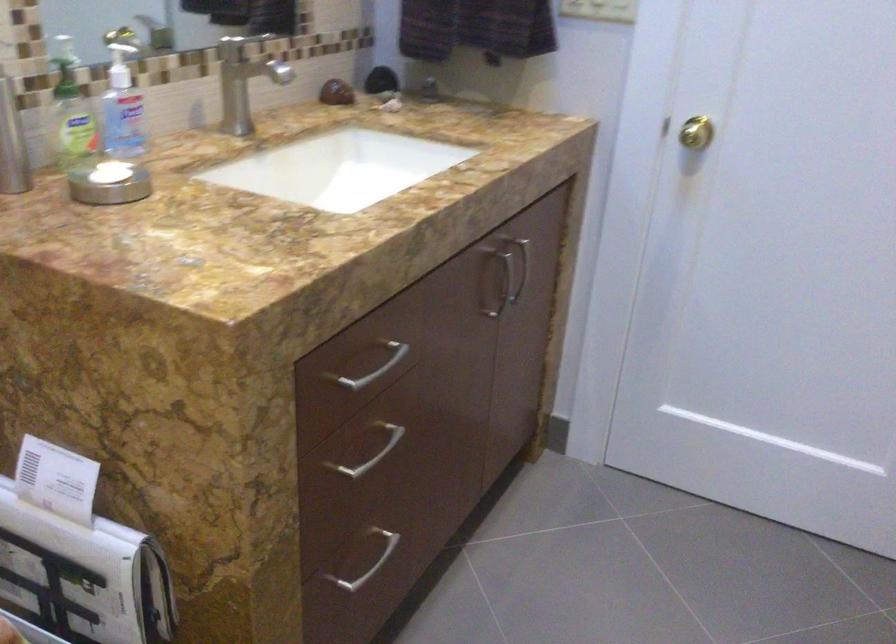
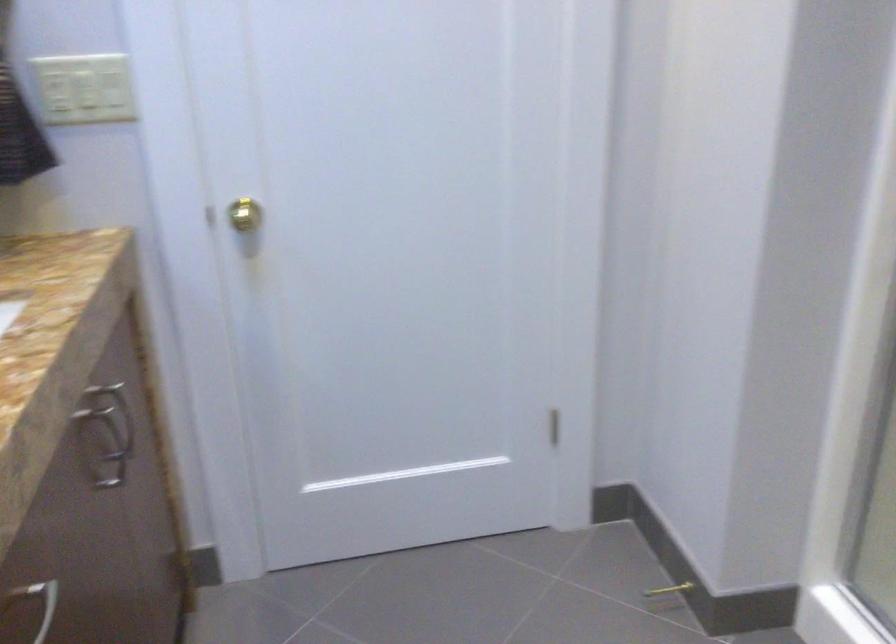
Locate, in the second image, the point that corresponds to pixel 497 290 in the first image.

(113, 453)